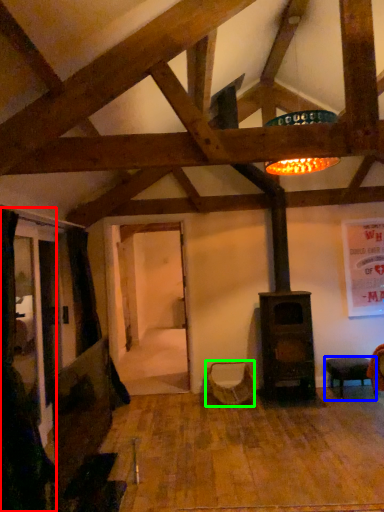
Question: Considering the real-world distances, which object is farthest from curtain (highlighted by a red box)? furniture (highlighted by a blue box) or swivel chair (highlighted by a green box)?

Choices:
 (A) furniture
 (B) swivel chair

Answer: (A)